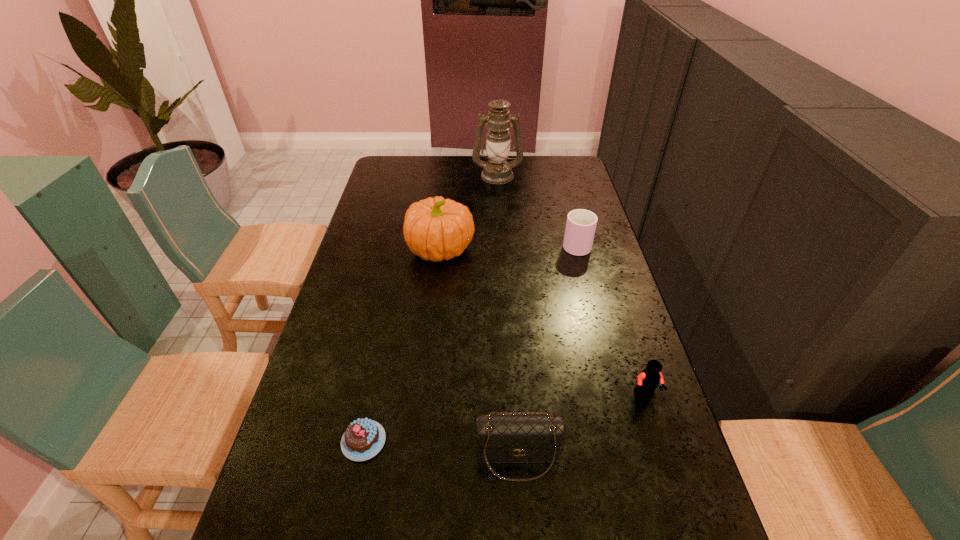
This screenshot has width=960, height=540. I want to click on vacant space situated with the handle on the side of the cup, so click(x=560, y=180).

Identify the location of free spot located with the handle on the side of the cup. (559, 177).

Where is `vacant region located 0.140m on the front-facing side of the Lego`? The image size is (960, 540). vacant region located 0.140m on the front-facing side of the Lego is located at coordinates (666, 461).

Locate an element on the screen. This screenshot has width=960, height=540. free region located 0.140m on the front of the shortest object is located at coordinates (344, 536).

This screenshot has height=540, width=960. In order to click on object that is positioned at the far edge in this screenshot , I will do point(497,170).

I want to click on object situated at the left edge, so click(x=364, y=438).

Locate an element on the screen. cup situated at the right edge is located at coordinates (581, 224).

At what (x,y) coordinates should I click in order to perform the action: click on Lego located at the right edge. Please return your answer as a coordinate pair (x, y). Image resolution: width=960 pixels, height=540 pixels. Looking at the image, I should click on (649, 379).

Where is `vacant area at the far edge of the desktop`? Image resolution: width=960 pixels, height=540 pixels. vacant area at the far edge of the desktop is located at coordinates (538, 174).

The height and width of the screenshot is (540, 960). Find the location of `free region at the left edge of the desktop`. free region at the left edge of the desktop is located at coordinates (364, 256).